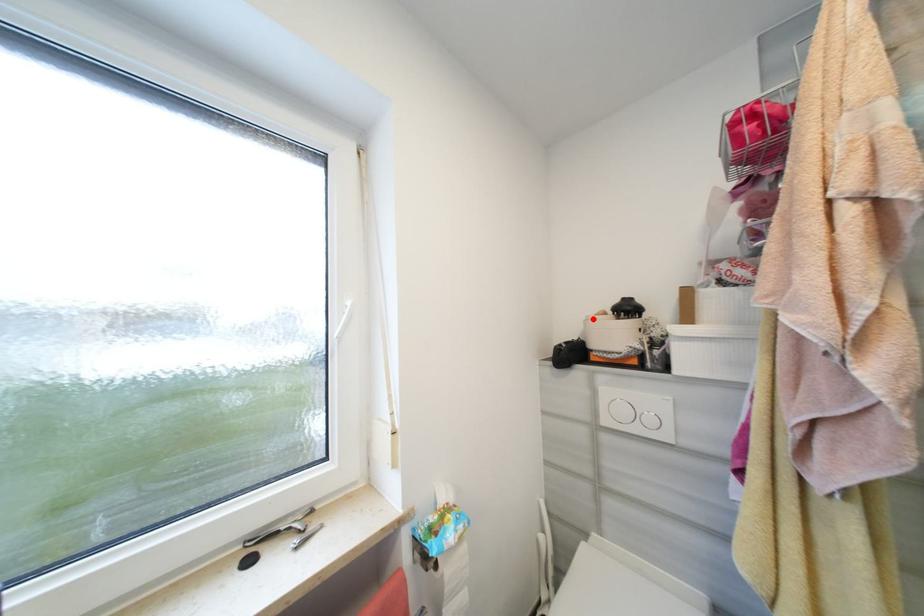
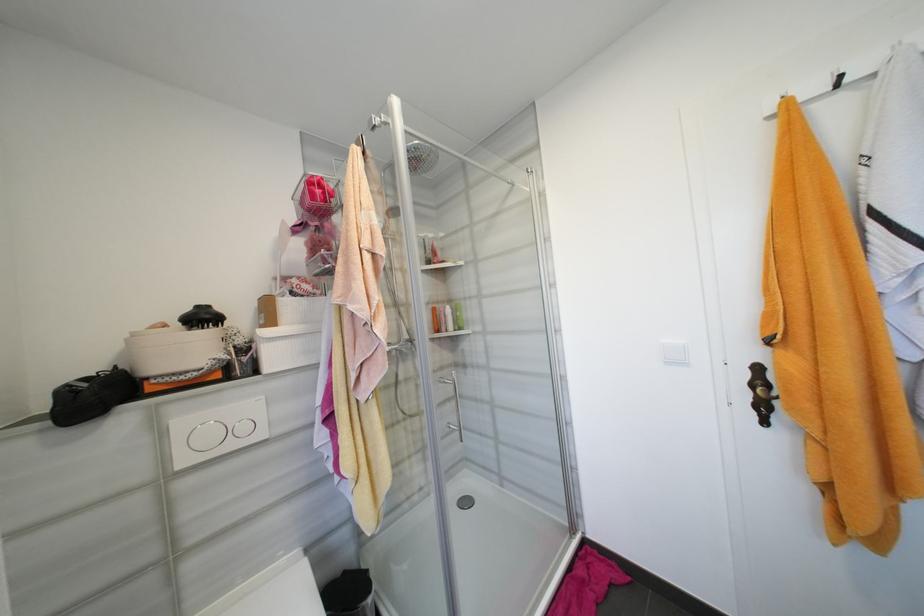
Locate, in the second image, the point that corresponds to the highlighted location in the first image.

(140, 334)